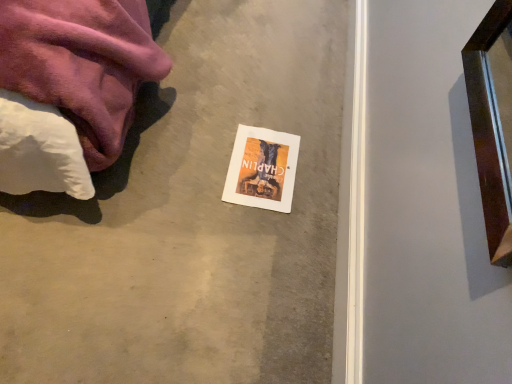
Locate an element on the screen. free space to the left of orange matte paper flyer at center is located at coordinates (193, 146).